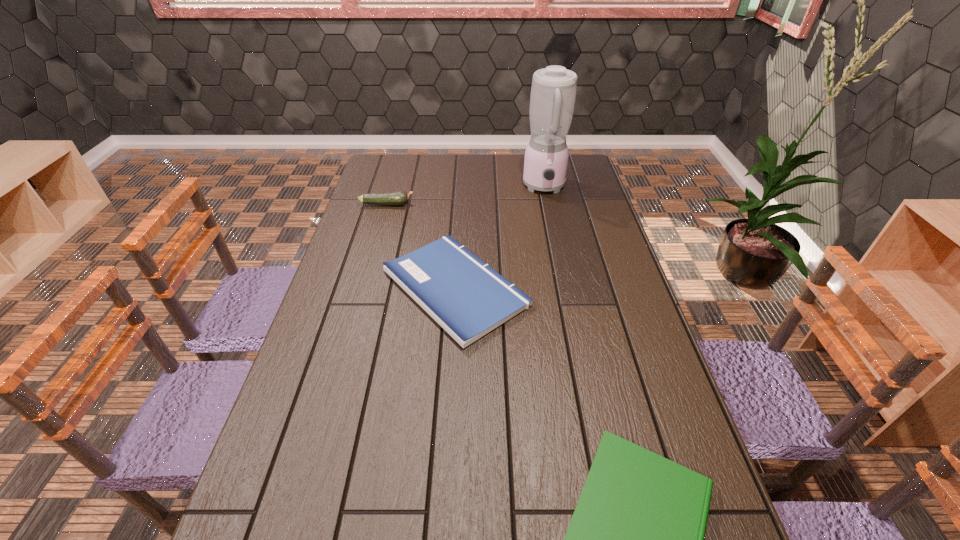
Image resolution: width=960 pixels, height=540 pixels. I want to click on food processor, so click(553, 92).

At what (x,y) coordinates should I click in order to perform the action: click on zucchini. Please return your answer as a coordinate pair (x, y). Looking at the image, I should click on (398, 197).

Where is `the third farthest object`? the third farthest object is located at coordinates (467, 298).

Find the location of a particular element. This screenshot has height=540, width=960. blank space located on the base of the tallest object near the control knob is located at coordinates (559, 257).

Locate an element on the screen. Image resolution: width=960 pixels, height=540 pixels. free space located at the blossom end of the second tallest object is located at coordinates (517, 204).

The height and width of the screenshot is (540, 960). Identify the location of vacant point located on the front of the third farthest object. tap(446, 436).

The image size is (960, 540). What are the coordinates of `object located at the far edge` in the screenshot? It's located at (553, 92).

This screenshot has width=960, height=540. I want to click on zucchini that is at the left edge, so click(398, 197).

The width and height of the screenshot is (960, 540). I want to click on paperback book that is at the left edge, so click(x=467, y=298).

Find the location of `object at the right edge`. object at the right edge is located at coordinates (553, 92).